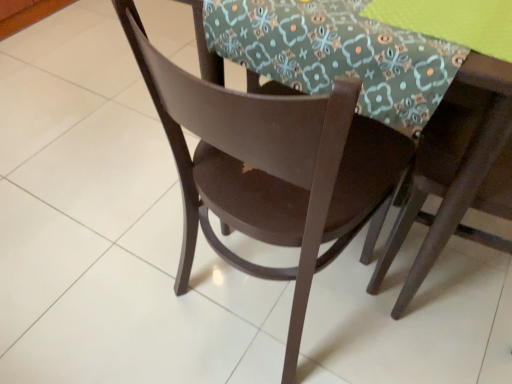
Question: Is matte brown chair at center, which is the 2th chair from right to left, at the back of matte brown table at center?

Choices:
 (A) yes
 (B) no

Answer: (B)

Question: Is matte brown table at center facing towards matte brown chair at center, which is the 2th chair from right to left?

Choices:
 (A) yes
 (B) no

Answer: (B)

Question: Does matte brown table at center lie in front of matte brown chair at center, acting as the first chair starting from the left?

Choices:
 (A) no
 (B) yes

Answer: (A)

Question: From the image's perspective, is matte brown table at center located above matte brown chair at center, acting as the first chair starting from the left?

Choices:
 (A) yes
 (B) no

Answer: (A)

Question: From the image's perspective, is matte brown table at center located beneath matte brown chair at center, acting as the first chair starting from the left?

Choices:
 (A) no
 (B) yes

Answer: (A)

Question: From a real-world perspective, is floral fabric at center above or below matte brown chair at center, acting as the first chair starting from the left?

Choices:
 (A) below
 (B) above

Answer: (B)

Question: Based on their sizes in the image, would you say floral fabric at center is bigger or smaller than matte brown chair at center, acting as the first chair starting from the left?

Choices:
 (A) big
 (B) small

Answer: (B)

Question: In terms of width, does floral fabric at center look wider or thinner when compared to matte brown chair at center, acting as the first chair starting from the left?

Choices:
 (A) wide
 (B) thin

Answer: (B)

Question: From the image's perspective, relative to matte brown chair at center, which is the 2th chair from right to left, is floral fabric at center above or below?

Choices:
 (A) below
 (B) above

Answer: (B)

Question: Is point (391, 64) closer or farther from the camera than point (238, 49)?

Choices:
 (A) farther
 (B) closer

Answer: (B)

Question: Visually, is floral fabric at center positioned to the left or to the right of matte brown table at center?

Choices:
 (A) left
 (B) right

Answer: (A)

Question: Is floral fabric at center wider or thinner than matte brown table at center?

Choices:
 (A) thin
 (B) wide

Answer: (A)

Question: Based on their sizes in the image, would you say floral fabric at center is bigger or smaller than matte brown table at center?

Choices:
 (A) big
 (B) small

Answer: (B)

Question: Does point (361, 140) appear closer or farther from the camera than point (477, 67)?

Choices:
 (A) closer
 (B) farther

Answer: (B)

Question: From a real-world perspective, is matte brown chair at center, acting as the first chair starting from the left, positioned above or below matte brown table at center?

Choices:
 (A) below
 (B) above

Answer: (B)